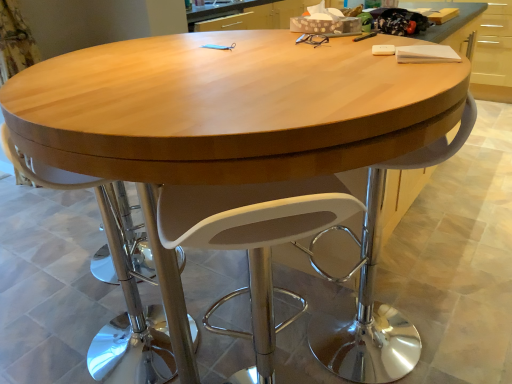
Question: Considering the relative positions of white plastic chair at center and white plastic swivel chair at center in the image provided, is white plastic chair at center behind white plastic swivel chair at center?

Choices:
 (A) no
 (B) yes

Answer: (B)

Question: From a real-world perspective, is white plastic chair at center under white plastic swivel chair at center?

Choices:
 (A) no
 (B) yes

Answer: (B)

Question: Can you see white plastic chair at center touching white plastic swivel chair at center?

Choices:
 (A) no
 (B) yes

Answer: (A)

Question: Would you say white plastic chair at center is a long distance from white plastic swivel chair at center?

Choices:
 (A) no
 (B) yes

Answer: (A)

Question: Is white plastic chair at center surrounding white plastic swivel chair at center?

Choices:
 (A) no
 (B) yes

Answer: (A)

Question: Does white plastic chair at center have a larger size compared to white plastic swivel chair at center?

Choices:
 (A) yes
 (B) no

Answer: (A)

Question: Is white plastic swivel chair at center thinner than white plastic chair at center?

Choices:
 (A) yes
 (B) no

Answer: (A)

Question: Would you consider white plastic swivel chair at center to be distant from white plastic chair at center?

Choices:
 (A) no
 (B) yes

Answer: (A)

Question: From the image's perspective, is white plastic swivel chair at center on top of white plastic chair at center?

Choices:
 (A) yes
 (B) no

Answer: (B)

Question: Can you confirm if white plastic swivel chair at center is shorter than white plastic chair at center?

Choices:
 (A) no
 (B) yes

Answer: (B)

Question: Is white plastic swivel chair at center facing away from white plastic chair at center?

Choices:
 (A) no
 (B) yes

Answer: (A)

Question: Does white plastic swivel chair at center turn towards white plastic chair at center?

Choices:
 (A) no
 (B) yes

Answer: (A)

Question: Is white plastic swivel chair at center taller or shorter than white plastic chair at center?

Choices:
 (A) tall
 (B) short

Answer: (B)